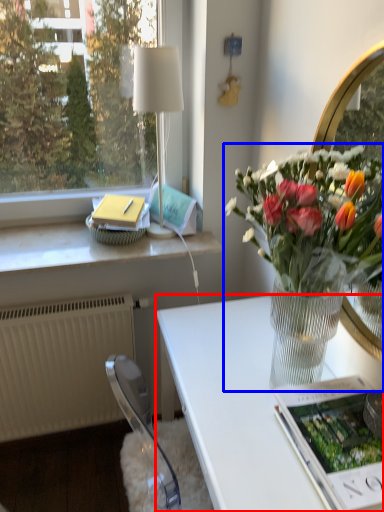
Question: Which object is further to the camera taking this photo, desk (highlighted by a red box) or houseplant (highlighted by a blue box)?

Choices:
 (A) desk
 (B) houseplant

Answer: (A)